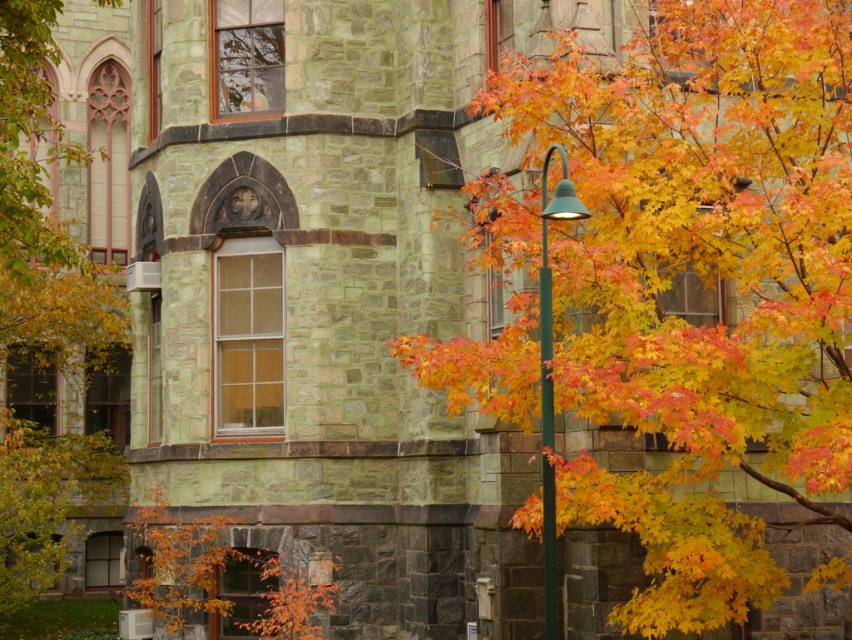
Question: Which point is closer to the camera taking this photo?

Choices:
 (A) (42, 502)
 (B) (545, 493)

Answer: (B)

Question: Does autumn leaves at left appear over green metallic pole at center?

Choices:
 (A) yes
 (B) no

Answer: (A)

Question: Is autumn leaves at left bigger than green metallic pole at center?

Choices:
 (A) yes
 (B) no

Answer: (A)

Question: Which of these objects is positioned closest to the autumn leaves at right?

Choices:
 (A) green metallic pole at center
 (B) autumn leaves at left

Answer: (A)

Question: Among these points, which one is farthest from the camera?

Choices:
 (A) (792, 364)
 (B) (551, 435)

Answer: (A)

Question: Does autumn leaves at right have a smaller size compared to autumn leaves at left?

Choices:
 (A) yes
 (B) no

Answer: (A)